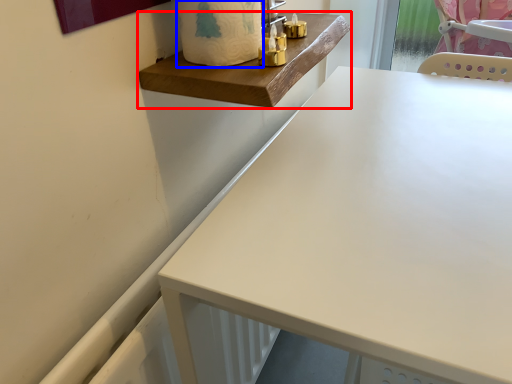
Question: Among these objects, which one is nearest to the camera, changing table (highlighted by a red box) or toilet paper (highlighted by a blue box)?

Choices:
 (A) changing table
 (B) toilet paper

Answer: (B)